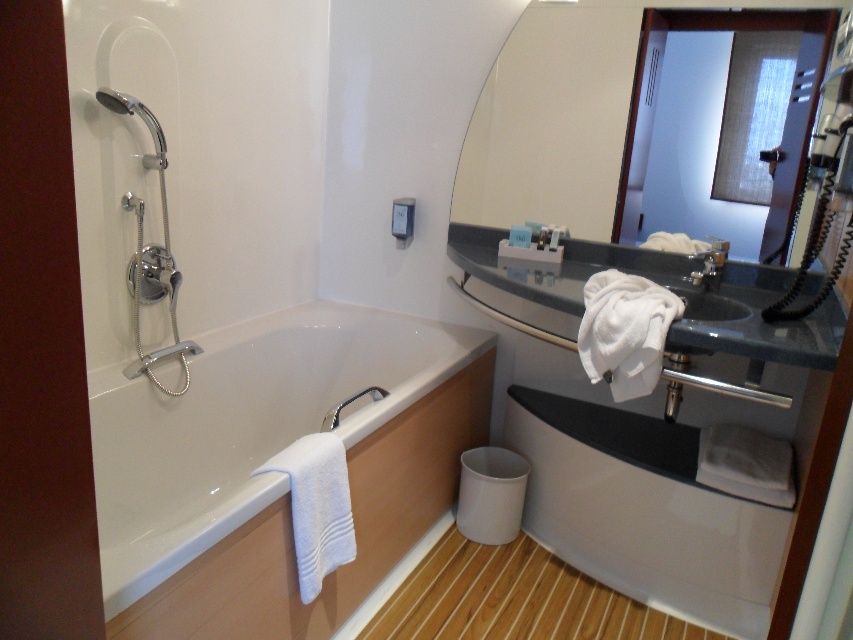
From the picture: Does white glossy bathtub at lower left appear under matte silver shower head at left?

Yes.

In the scene shown: Is white glossy bathtub at lower left thinner than matte silver shower head at left?

No.

Does point (190, 365) lie behind point (123, 97)?

Yes, point (190, 365) is farther from viewer.

The height and width of the screenshot is (640, 853). What are the coordinates of `white glossy bathtub at lower left` in the screenshot? It's located at (277, 472).

Can you confirm if clear glass mirror at upper center is thinner than white glossy sink at upper center?

No, clear glass mirror at upper center is not thinner than white glossy sink at upper center.

Which is behind, point (717, 204) or point (682, 292)?

The point (717, 204) is more distant.

Identify the location of clear glass mirror at upper center. (553, 116).

From the picture: Is clear glass mirror at upper center to the right of matte silver shower head at left from the viewer's perspective?

Indeed, clear glass mirror at upper center is positioned on the right side of matte silver shower head at left.

Looking at this image, between clear glass mirror at upper center and matte silver shower head at left, which one appears on the right side from the viewer's perspective?

Positioned to the right is clear glass mirror at upper center.

Is point (560, 141) farther from viewer compared to point (135, 113)?

Yes, it is.

Image resolution: width=853 pixels, height=640 pixels. Identify the location of clear glass mirror at upper center. (553, 116).